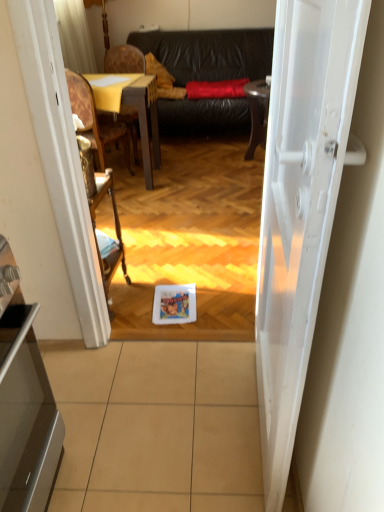
The width and height of the screenshot is (384, 512). What do you see at coordinates (124, 60) in the screenshot?
I see `wooden textured chair at left, the 2th chair when ordered from front to back` at bounding box center [124, 60].

This screenshot has width=384, height=512. Identify the location of beige tile at center. (157, 426).

Identify the location of white glossy door at center. The image size is (384, 512). (300, 205).

What do you see at coordinates (96, 120) in the screenshot? I see `wooden polished chair at left, which is counted as the second chair, starting from the back` at bounding box center [96, 120].

This screenshot has width=384, height=512. I want to click on metallic silver oven at lower left, so click(24, 402).

Measure the distance between black leather couch at center and camera.

black leather couch at center and camera are 4.31 meters apart from each other.

Locate an element on the screen. The height and width of the screenshot is (512, 384). wooden textured chair at left, which is the first chair in back-to-front order is located at coordinates (124, 60).

Is white glossy door at center not close to black leather couch at center?

white glossy door at center is far away from black leather couch at center.

Considering the sizes of objects white glossy door at center and black leather couch at center in the image provided, who is wider, white glossy door at center or black leather couch at center?

With larger width is black leather couch at center.

Based on the photo, is black leather couch at center inside white glossy door at center?

Definitely not — black leather couch at center is not inside white glossy door at center.

In the image, is white glossy door at center positioned in front of or behind black leather couch at center?

In the image, white glossy door at center appears in front of black leather couch at center.

Is black leather couch at center surrounding metallic silver oven at lower left?

No, metallic silver oven at lower left is not a part of black leather couch at center.

Is black leather couch at center further to camera compared to metallic silver oven at lower left?

That is True.

Who is taller, black leather couch at center or metallic silver oven at lower left?

Standing taller between the two is black leather couch at center.

How many degrees apart are the facing directions of black leather couch at center and metallic silver oven at lower left?

89.3 degrees separate the facing orientations of black leather couch at center and metallic silver oven at lower left.

Considering the positions of objects beige tile at center and white glossy door at center in the image provided, who is more to the right, beige tile at center or white glossy door at center?

white glossy door at center is more to the right.

Consider the image. From a real-world perspective, is beige tile at center positioned over white glossy door at center based on gravity?

No, from a real-world perspective, beige tile at center is not above white glossy door at center.

Is beige tile at center far away from white glossy door at center?

No.

Is beige tile at center positioned with its back to white glossy door at center?

No, beige tile at center's orientation is not away from white glossy door at center.

Locate an element on the screen. This screenshot has width=384, height=512. appliance in front of the black leather couch at center is located at coordinates (24, 402).

Considering the positions of objects metallic silver oven at lower left and black leather couch at center in the image provided, who is more to the right, metallic silver oven at lower left or black leather couch at center?

Positioned to the right is black leather couch at center.

What's the angular difference between metallic silver oven at lower left and black leather couch at center's facing directions?

metallic silver oven at lower left and black leather couch at center are facing 89.3 degrees away from each other.

Does wooden armchair at center touch white glossy door at center?

No, wooden armchair at center is not next to white glossy door at center.

Which is behind, point (88, 87) or point (323, 72)?

The point (88, 87) is behind.

Considering the sizes of objects wooden armchair at center and white glossy door at center in the image provided, who is shorter, wooden armchair at center or white glossy door at center?

wooden armchair at center.

Considering the relative sizes of wooden armchair at center and white glossy door at center in the image provided, is wooden armchair at center smaller than white glossy door at center?

Yes.

Is wooden textured chair at left, the 2th chair when ordered from front to back, not within wooden armchair at center?

Yes, wooden textured chair at left, the 2th chair when ordered from front to back, is not within wooden armchair at center.

Locate an element on the screen. This screenshot has height=512, width=384. armchair on the right of wooden textured chair at left, the 2th chair when ordered from front to back is located at coordinates (101, 176).

Consider the image. From the image's perspective, between wooden textured chair at left, the 2th chair when ordered from front to back, and wooden armchair at center, who is located below?

wooden armchair at center, from the image's perspective.

Considering the sizes of objects wooden textured chair at left, the 2th chair when ordered from front to back, and wooden armchair at center in the image provided, who is shorter, wooden textured chair at left, the 2th chair when ordered from front to back, or wooden armchair at center?

Standing shorter between the two is wooden armchair at center.

In order to click on door above the black leather couch at center (from a real-world perspective) in this screenshot , I will do (x=300, y=205).

Are black leather couch at center and white glossy door at center located far from each other?

Yes, black leather couch at center and white glossy door at center are quite far apart.

Considering the sizes of objects black leather couch at center and white glossy door at center in the image provided, who is shorter, black leather couch at center or white glossy door at center?

Standing shorter between the two is black leather couch at center.

You are a GUI agent. You are given a task and a screenshot of the screen. Output one action in this format:
    pyautogui.click(x=<x>, y=<y>)
    Task: Click on the door that is above the black leather couch at center (from a real-world perspective)
    
    Given the screenshot: What is the action you would take?
    pyautogui.click(x=300, y=205)

At what (x,y) coordinates should I click in order to perform the action: click on appliance below the black leather couch at center (from a real-world perspective). Please return your answer as a coordinate pair (x, y). Looking at the image, I should click on (24, 402).

From the image, which object appears to be nearer to wooden armchair at center, white glossy door at center or beige tile at center?

beige tile at center is positioned closer to the anchor wooden armchair at center.

Looking at the image, which one is located further to beige tile at center, black leather couch at center or wooden armchair at center?

Based on the image, black leather couch at center appears to be further to beige tile at center.

Based on their spatial positions, is wooden polished chair at left, which is counted as the second chair, starting from the back, or white glossy door at center further from wooden textured chair at left, the 2th chair when ordered from front to back?

white glossy door at center is further to wooden textured chair at left, the 2th chair when ordered from front to back.

Based on their spatial positions, is wooden polished chair at left, which is counted as the second chair, starting from the back, or metallic silver oven at lower left further from wooden textured chair at left, the 2th chair when ordered from front to back?

Among the two, metallic silver oven at lower left is located further to wooden textured chair at left, the 2th chair when ordered from front to back.

Based on their spatial positions, is beige tile at center or black leather couch at center closer to wooden armchair at center?

beige tile at center is closer to wooden armchair at center.

Based on their spatial positions, is beige tile at center or wooden armchair at center further from wooden polished chair at left, arranged as the first chair when viewed from the front?

beige tile at center is further to wooden polished chair at left, arranged as the first chair when viewed from the front.

Considering their positions, is wooden armchair at center positioned closer to metallic silver oven at lower left than wooden textured chair at left, which is the first chair in back-to-front order?

wooden armchair at center lies closer to metallic silver oven at lower left than the other object.

Based on their spatial positions, is wooden textured chair at left, the 2th chair when ordered from front to back, or metallic silver oven at lower left further from wooden polished chair at left, arranged as the first chair when viewed from the front?

Based on the image, wooden textured chair at left, the 2th chair when ordered from front to back, appears to be further to wooden polished chair at left, arranged as the first chair when viewed from the front.

Identify the location of chair between metallic silver oven at lower left and wooden textured chair at left, which is the first chair in back-to-front order, from front to back. (96, 120).

At what (x,y) coordinates should I click in order to perform the action: click on tile between white glossy door at center and wooden textured chair at left, the 2th chair when ordered from front to back, in the front-back direction. Please return your answer as a coordinate pair (x, y). Image resolution: width=384 pixels, height=512 pixels. Looking at the image, I should click on (157, 426).

Identify the location of tile located between white glossy door at center and wooden polished chair at left, which is counted as the second chair, starting from the back, in the depth direction. (157, 426).

Where is `armchair located between white glossy door at center and wooden polished chair at left, which is counted as the second chair, starting from the back, in the depth direction`? The width and height of the screenshot is (384, 512). armchair located between white glossy door at center and wooden polished chair at left, which is counted as the second chair, starting from the back, in the depth direction is located at coordinates (101, 176).